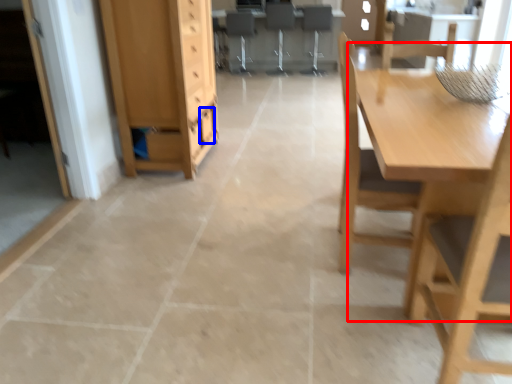
Question: Among these objects, which one is farthest to the camera, table (highlighted by a red box) or drawer (highlighted by a blue box)?

Choices:
 (A) table
 (B) drawer

Answer: (B)